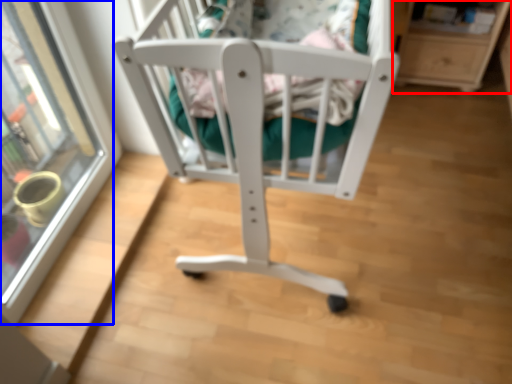
Question: Which object appears closest to the camera in this image, shelf (highlighted by a red box) or glass door (highlighted by a blue box)?

Choices:
 (A) shelf
 (B) glass door

Answer: (B)